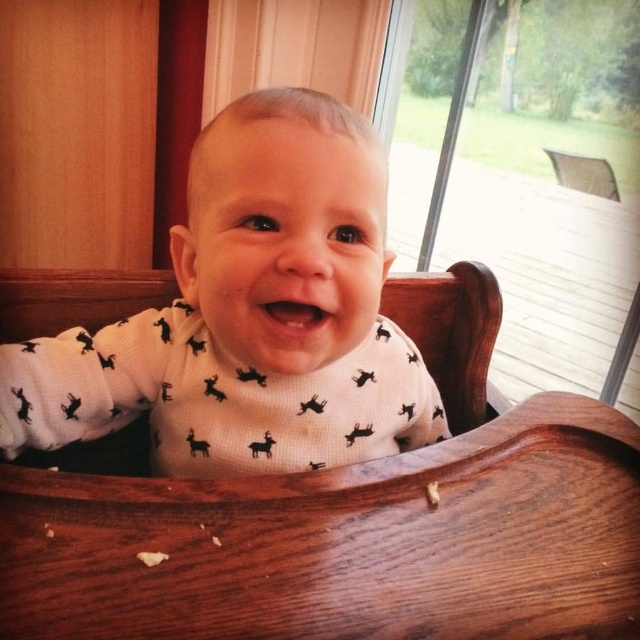
You are a photographer setting up a shot of the baby in the high chair. You want to ensure the white matte onesie at center is visible in the reflection of the transparent glass screen door at upper right. Will the onesie be visible in the reflection?

The white matte onesie at center is to the left of the transparent glass screen door at upper right, so the onesie will be visible in the reflection of the screen door.

You are a parent holding a baby in a white matte onesie at center and want to place them in a high chair near the transparent glass screen door at upper right. Can you safely place the baby in the high chair without the onesie getting too close to the screen door?

The white matte onesie at center is 1.09 meters away from the transparent glass screen door at upper right. Since the distance is sufficient, placing the baby in the high chair will keep the onesie at a safe distance from the screen door, so yes, it can be done safely.

You are a photographer trying to capture the baby in the white matte onesie at center through the transparent glass screen door at upper right. Since the screen door is partially open, will the onesie be fully visible through the door?

The white matte onesie at center is smaller than the transparent glass screen door at upper right, so yes, the onesie will be fully visible through the transparent glass screen door at upper right since the door is larger and can accommodate the smaller onesie.